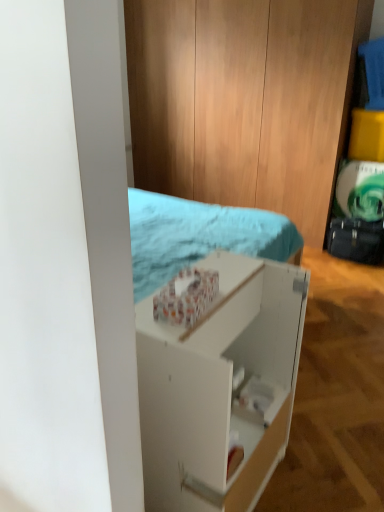
You are a GUI agent. You are given a task and a screenshot of the screen. Output one action in this format:
    pyautogui.click(x=<x>, y=<y>)
    Task: Click on the black leather suitcase at right
    The width and height of the screenshot is (384, 512).
    Given the screenshot: What is the action you would take?
    pyautogui.click(x=356, y=240)

Measure the distance between point (362, 237) and camera.

3.33 meters.

This screenshot has height=512, width=384. What do you see at coordinates (356, 240) in the screenshot?
I see `black leather suitcase at right` at bounding box center [356, 240].

The width and height of the screenshot is (384, 512). What do you see at coordinates (220, 387) in the screenshot? I see `white matte shelf at center` at bounding box center [220, 387].

You are a GUI agent. You are given a task and a screenshot of the screen. Output one action in this format:
    pyautogui.click(x=<x>, y=<y>)
    Task: Click on the white matte shelf at center
    This screenshot has width=384, height=512.
    Given the screenshot: What is the action you would take?
    pyautogui.click(x=220, y=387)

The width and height of the screenshot is (384, 512). I want to click on black leather suitcase at right, so click(356, 240).

Does white matte shelf at center appear on the left side of black leather suitcase at right?

Correct, you'll find white matte shelf at center to the left of black leather suitcase at right.

Does white matte shelf at center lie in front of black leather suitcase at right?

Yes.

Which is closer, (156,433) or (357,231)?

The point (156,433) is in front.

From the image's perspective, which one is positioned lower, white matte shelf at center or black leather suitcase at right?

white matte shelf at center is shown below in the image.

From a real-world perspective, relative to black leather suitcase at right, is white matte shelf at center vertically above or below?

In terms of real-world spatial position, white matte shelf at center is above black leather suitcase at right.

Looking at their sizes, would you say white matte shelf at center is wider or thinner than black leather suitcase at right?

white matte shelf at center is wider than black leather suitcase at right.

From their relative heights in the image, would you say white matte shelf at center is taller or shorter than black leather suitcase at right?

Clearly, white matte shelf at center is taller compared to black leather suitcase at right.

Who is smaller, white matte shelf at center or black leather suitcase at right?

black leather suitcase at right.

Is white matte shelf at center spatially inside black leather suitcase at right, or outside of it?

white matte shelf at center is not enclosed by black leather suitcase at right.

Is the surface of white matte shelf at center in direct contact with black leather suitcase at right?

No, white matte shelf at center is not with black leather suitcase at right.

Is white matte shelf at center positioned with its back to black leather suitcase at right?

white matte shelf at center does not have its back to black leather suitcase at right.

Measure the distance between white matte shelf at center and black leather suitcase at right.

They are 2.20 meters apart.

The width and height of the screenshot is (384, 512). I want to click on shelf below the black leather suitcase at right (from the image's perspective), so click(220, 387).

Between black leather suitcase at right and white matte shelf at center, which one appears on the left side from the viewer's perspective?

white matte shelf at center.

Is the position of black leather suitcase at right more distant than that of white matte shelf at center?

Yes, it is.

Considering the points (336, 230) and (184, 396), which point is in front, point (336, 230) or point (184, 396)?

The point (184, 396) is closer to the camera.

Based on the photo, from the image's perspective, who appears lower, black leather suitcase at right or white matte shelf at center?

white matte shelf at center, from the image's perspective.

From a real-world perspective, which object stands above the other?

From a 3D spatial view, white matte shelf at center is above.

Which of these two, black leather suitcase at right or white matte shelf at center, is thinner?

black leather suitcase at right.

Considering the sizes of objects black leather suitcase at right and white matte shelf at center in the image provided, who is taller, black leather suitcase at right or white matte shelf at center?

white matte shelf at center.

Can you confirm if black leather suitcase at right is smaller than white matte shelf at center?

Yes, black leather suitcase at right is smaller than white matte shelf at center.

Is black leather suitcase at right not within white matte shelf at center?

Yes, black leather suitcase at right is located beyond the bounds of white matte shelf at center.

Is black leather suitcase at right not close to white matte shelf at center?

Yes, black leather suitcase at right is far from white matte shelf at center.

In the scene shown: Does black leather suitcase at right turn towards white matte shelf at center?

Yes, black leather suitcase at right is oriented towards white matte shelf at center.

Image resolution: width=384 pixels, height=512 pixels. Find the location of `luggage to the right of white matte shelf at center`. luggage to the right of white matte shelf at center is located at coordinates (356, 240).

At what (x,y) coordinates should I click in order to perform the action: click on luggage below the white matte shelf at center (from a real-world perspective). Please return your answer as a coordinate pair (x, y). This screenshot has width=384, height=512. Looking at the image, I should click on (356, 240).

You are a GUI agent. You are given a task and a screenshot of the screen. Output one action in this format:
    pyautogui.click(x=<x>, y=<y>)
    Task: Click on the luggage that appears on the right of white matte shelf at center
    The width and height of the screenshot is (384, 512).
    Given the screenshot: What is the action you would take?
    click(x=356, y=240)